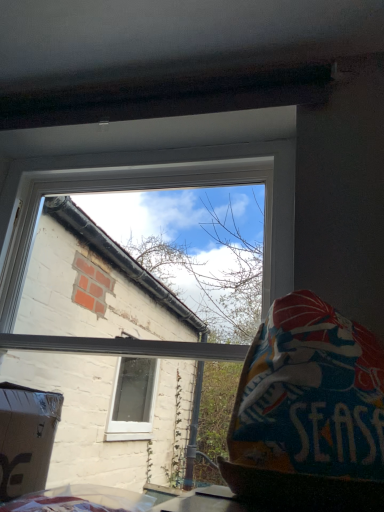
Describe the element at coordinates (309, 412) in the screenshot. I see `textured fabric bean bag at right` at that location.

In order to face textured fabric bean bag at right, should I rotate leftwards or rightwards?

To face it directly, rotate right by 15.784 degrees.

At what (x,y) coordinates should I click in order to perform the action: click on textured fabric bean bag at right. Please return your answer as a coordinate pair (x, y). Looking at the image, I should click on (309, 412).

Image resolution: width=384 pixels, height=512 pixels. What do you see at coordinates (161, 187) in the screenshot?
I see `white plastic window at upper center` at bounding box center [161, 187].

Where is `white plastic window at upper center`? white plastic window at upper center is located at coordinates (161, 187).

Locate an element on the screen. This screenshot has width=384, height=512. textured fabric bean bag at right is located at coordinates (309, 412).

Looking at this image, considering the positions of objects textured fabric bean bag at right and white plastic window at upper center in the image provided, who is more to the right, textured fabric bean bag at right or white plastic window at upper center?

textured fabric bean bag at right is more to the right.

Between textured fabric bean bag at right and white plastic window at upper center, which one is positioned behind?

white plastic window at upper center.

Does point (272, 424) come in front of point (232, 156)?

Yes.

From the image's perspective, is textured fabric bean bag at right on white plastic window at upper center?

No, from the image's perspective, textured fabric bean bag at right is not above white plastic window at upper center.

From a real-world perspective, is textured fabric bean bag at right over white plastic window at upper center?

Actually, textured fabric bean bag at right is physically below white plastic window at upper center in the real world.

Considering the relative sizes of textured fabric bean bag at right and white plastic window at upper center in the image provided, is textured fabric bean bag at right wider than white plastic window at upper center?

Indeed, textured fabric bean bag at right has a greater width compared to white plastic window at upper center.

Does textured fabric bean bag at right have a greater height compared to white plastic window at upper center?

Incorrect, the height of textured fabric bean bag at right is not larger of that of white plastic window at upper center.

Between textured fabric bean bag at right and white plastic window at upper center, which one has larger size?

With larger size is white plastic window at upper center.

Choose the correct answer: Is textured fabric bean bag at right inside white plastic window at upper center or outside it?

textured fabric bean bag at right is outside white plastic window at upper center.

Is textured fabric bean bag at right not close to white plastic window at upper center?

No, there isn't a large distance between textured fabric bean bag at right and white plastic window at upper center.

Is textured fabric bean bag at right facing towards white plastic window at upper center?

No, textured fabric bean bag at right does not turn towards white plastic window at upper center.

Find the location of a particular element. bean bag chair located below the white plastic window at upper center (from the image's perspective) is located at coordinates (309, 412).

Is white plastic window at upper center at the left side of textured fabric bean bag at right?

Correct, you'll find white plastic window at upper center to the left of textured fabric bean bag at right.

Is the position of white plastic window at upper center less distant than that of textured fabric bean bag at right?

That is False.

Considering the points (259, 157) and (375, 456), which point is behind, point (259, 157) or point (375, 456)?

The point (259, 157) is farther.

From the image's perspective, which is above, white plastic window at upper center or textured fabric bean bag at right?

white plastic window at upper center.

From a real-world perspective, is white plastic window at upper center on top of textured fabric bean bag at right?

Yes, from a real-world perspective, white plastic window at upper center is over textured fabric bean bag at right

Can you confirm if white plastic window at upper center is wider than textured fabric bean bag at right?

In fact, white plastic window at upper center might be narrower than textured fabric bean bag at right.

Which of these two, white plastic window at upper center or textured fabric bean bag at right, stands shorter?

textured fabric bean bag at right.

Who is bigger, white plastic window at upper center or textured fabric bean bag at right?

With larger size is white plastic window at upper center.

Is textured fabric bean bag at right located within white plastic window at upper center?

No, textured fabric bean bag at right is located outside of white plastic window at upper center.

Is white plastic window at upper center positioned far away from textured fabric bean bag at right?

No, white plastic window at upper center is not far from textured fabric bean bag at right.

Is white plastic window at upper center facing away from textured fabric bean bag at right?

No, textured fabric bean bag at right is not at the back of white plastic window at upper center.

Can you tell me how much white plastic window at upper center and textured fabric bean bag at right differ in facing direction?

0.727 degrees separate the facing orientations of white plastic window at upper center and textured fabric bean bag at right.

Find the location of `bean bag chair that is in front of the white plastic window at upper center`. bean bag chair that is in front of the white plastic window at upper center is located at coordinates (309, 412).

Where is `window above the textured fabric bean bag at right (from the image's perspective)`? The height and width of the screenshot is (512, 384). window above the textured fabric bean bag at right (from the image's perspective) is located at coordinates (161, 187).

Find the location of a particular element. This screenshot has width=384, height=512. bean bag chair in front of the white plastic window at upper center is located at coordinates (309, 412).